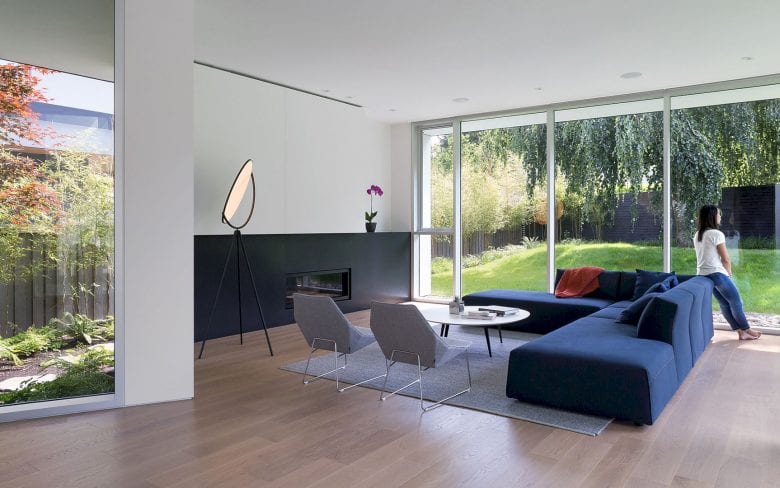
Locate an element on the screen. wooden floor is located at coordinates (256, 420).